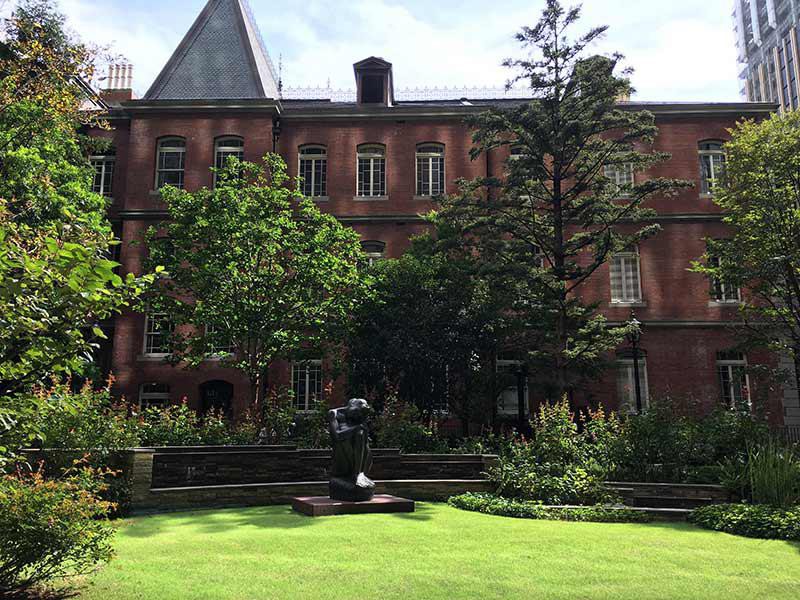
At what (x,y) coordinates should I click in order to perform the action: click on chimney. Please return your answer as a coordinate pair (x, y). This screenshot has height=600, width=800. Looking at the image, I should click on (125, 76), (108, 75).